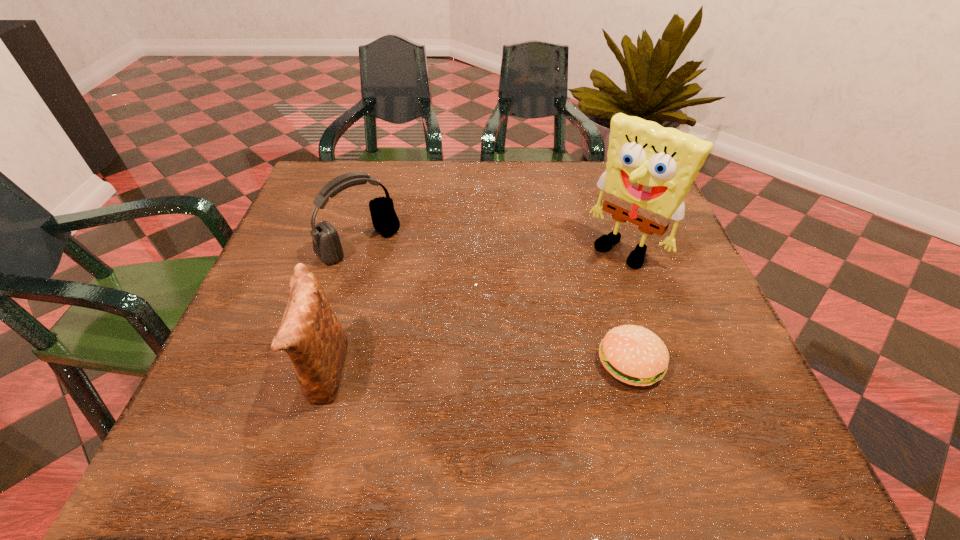
Find the location of a particular element. Image resolution: width=960 pixels, height=540 pixels. free spot between the tallest object and the headset is located at coordinates (x=492, y=246).

At what (x,y) coordinates should I click in order to perform the action: click on vacant area between the tallest object and the clutch bag. Please return your answer as a coordinate pair (x, y). Looking at the image, I should click on (474, 310).

At what (x,y) coordinates should I click in order to perform the action: click on free spot between the headset and the shortest object. Please return your answer as a coordinate pair (x, y). Looking at the image, I should click on (495, 303).

Find the location of `vacant area that lies between the sponge and the headset`. vacant area that lies between the sponge and the headset is located at coordinates (492, 246).

Select which object appears as the closest to the clutch bag. Please provide its 2D coordinates. Your answer should be formatted as a tuple, i.e. [(x, y)], where the tuple contains the x and y coordinates of a point satisfying the conditions above.

[(326, 243)]

Where is `the closest object to the tallest object`? the closest object to the tallest object is located at coordinates (632, 354).

This screenshot has width=960, height=540. I want to click on vacant space that satisfies the following two spatial constraints: 1. on the front side of the clutch bag; 2. on the open side of the headset, so click(x=323, y=373).

Where is `free space that satisfies the following two spatial constraints: 1. on the front side of the tallest object; 2. on the left side of the headset`? This screenshot has width=960, height=540. free space that satisfies the following two spatial constraints: 1. on the front side of the tallest object; 2. on the left side of the headset is located at coordinates (359, 248).